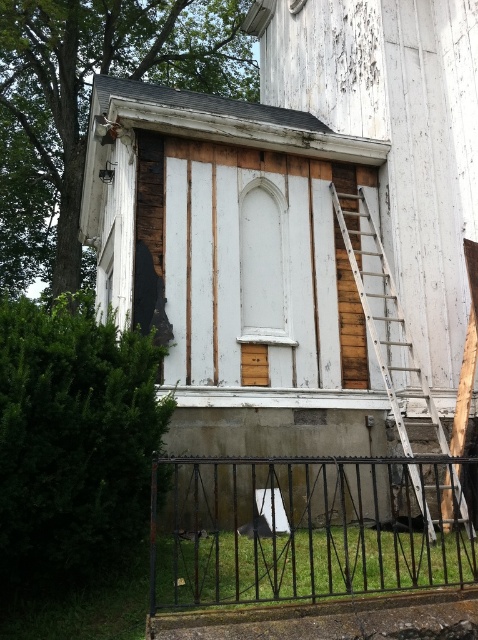
Can you confirm if black wrought iron fence at lower center is positioned to the right of wooden ladder at right?

In fact, black wrought iron fence at lower center is to the left of wooden ladder at right.

Is black wrought iron fence at lower center positioned in front of wooden ladder at right?

Yes, black wrought iron fence at lower center is closer to the viewer.

Which is in front, point (343, 586) or point (334, 202)?

Positioned in front is point (343, 586).

In order to click on black wrought iron fence at lower center in this screenshot , I will do `click(307, 528)`.